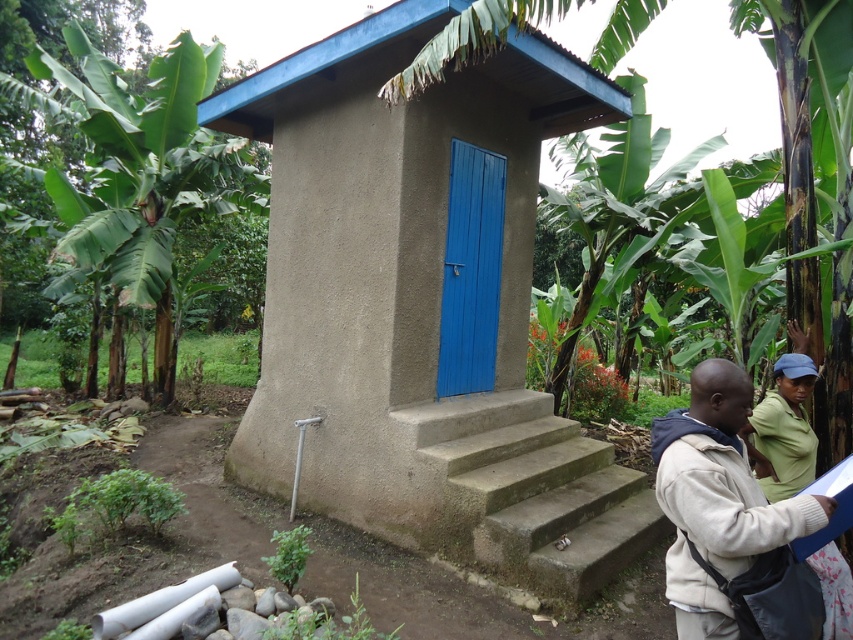
Question: Among these points, which one is nearest to the camera?

Choices:
 (A) (525, 408)
 (B) (486, 188)
 (C) (114, 198)

Answer: (B)

Question: Among these objects, which one is nearest to the camera?

Choices:
 (A) matte concrete hut at center
 (B) blue painted wood door at center
 (C) green leafy banana tree at left
 (D) concrete stairs at center

Answer: (D)

Question: Which of these objects is positioned closest to the matte concrete hut at center?

Choices:
 (A) green matte shirt at lower right
 (B) light beige jacket at lower right
 (C) blue painted wood door at center

Answer: (C)

Question: Can you confirm if matte concrete hut at center is thinner than concrete stairs at center?

Choices:
 (A) yes
 (B) no

Answer: (B)

Question: Can you confirm if matte concrete hut at center is positioned to the right of blue painted wood door at center?

Choices:
 (A) no
 (B) yes

Answer: (A)

Question: Can you confirm if concrete stairs at center is positioned to the right of green matte shirt at lower right?

Choices:
 (A) no
 (B) yes

Answer: (A)